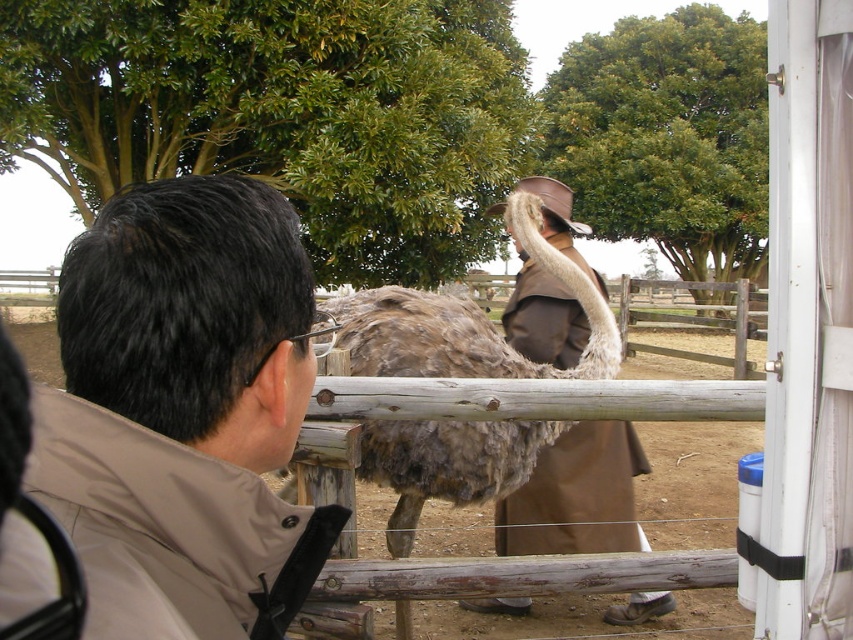
You are standing at the point labeled point (181, 372) and want to walk to the point labeled point (368, 374). Which direction should you move to get closer to your destination?

You should move away from the viewer to reach point (368, 374) since it is further away than your current position at point (181, 372).